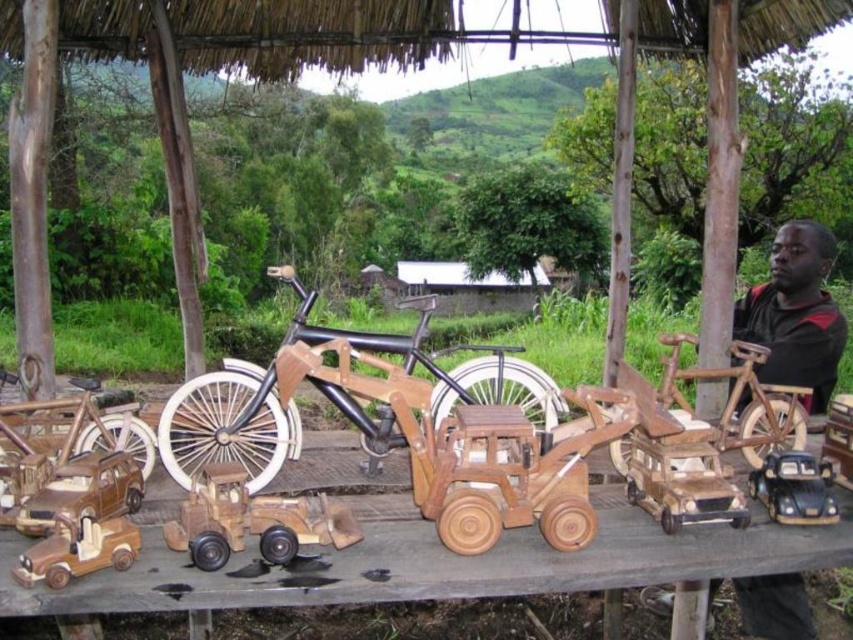
You are a customer at a wooden toy store and want to buy the wooden toy truck at center. The store uses a coordinate system where the bottom left corner is the origin. Can you confirm if the wooden toy truck at center is located at coordinates point (252,520)?

Yes, the wooden toy truck at center is located at point (252,520) as per the coordinate system provided.

You are a child who wants to reach the wooden matte truck at lower left from where you are standing. The adult says you need to move 5 feet to get it. Is this accurate?

The wooden matte truck at lower left is 5.25 feet away from you, so the adult is slightly incorrect. You need to move 5.25 feet to reach it.